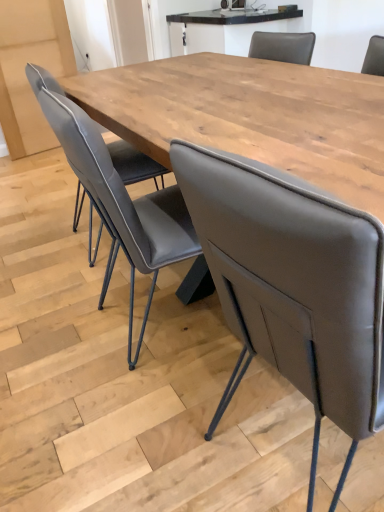
Question: Relative to matte gray chair at center, arranged as the first chair when viewed from the right, is wooden table at center, which is the 2th table in top-to-bottom order, in front or behind?

Choices:
 (A) behind
 (B) front

Answer: (A)

Question: Is wooden table at center, which is the 2th table in top-to-bottom order, wider or thinner than matte gray chair at center, arranged as the first chair when viewed from the right?

Choices:
 (A) wide
 (B) thin

Answer: (A)

Question: Estimate the real-world distances between objects in this image. Which object is farther from the wooden table at center, which is the 1th table from front to back?

Choices:
 (A) matte gray leather chair at center, arranged as the 2th chair when viewed from the right
 (B) matte gray chair at center, the 2th chair in the left-to-right sequence
 (C) light brown wood table at upper center, which is counted as the first table, starting from the top

Answer: (C)

Question: Which object is the closest to the matte gray chair at center, arranged as the first chair when viewed from the right?

Choices:
 (A) light brown wood table at upper center, which is counted as the 2th table, starting from the front
 (B) matte gray leather chair at center, the 1th chair positioned from the left
 (C) wooden table at center, which is the 2th table in top-to-bottom order

Answer: (B)